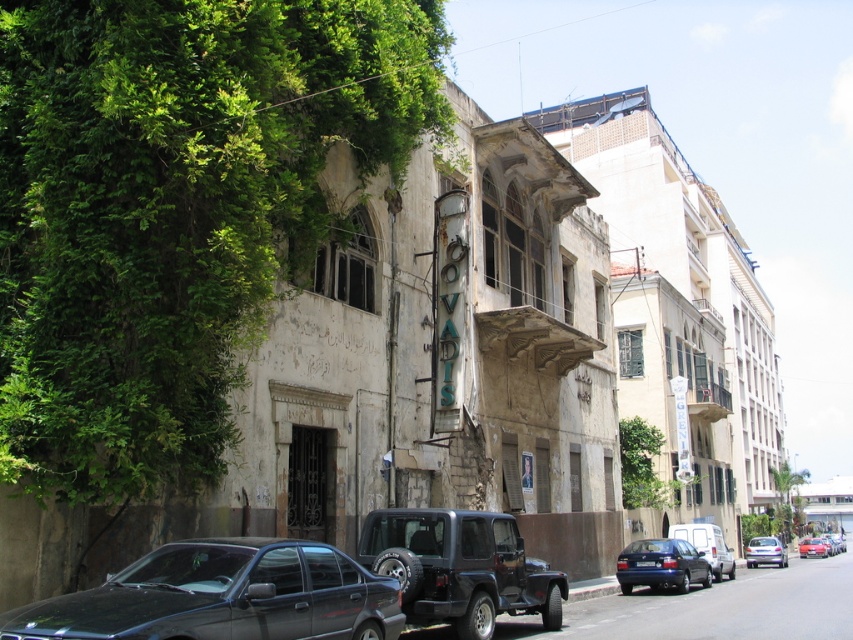
Does green leafy vines at left have a larger size compared to matte blue sedan at lower right?

Yes, green leafy vines at left is bigger than matte blue sedan at lower right.

Between point (273, 262) and point (646, 547), which one is positioned in front?

Point (273, 262) is in front.

This screenshot has width=853, height=640. I want to click on green leafy vines at left, so click(x=173, y=209).

Between purple glossy hatchback at lower right and blue matte license plate at center, which one has less height?

blue matte license plate at center is shorter.

What do you see at coordinates (764, 552) in the screenshot? I see `purple glossy hatchback at lower right` at bounding box center [764, 552].

Is point (759, 563) positioned behind point (637, 563)?

Yes, point (759, 563) is behind point (637, 563).

At what (x,y) coordinates should I click in order to perform the action: click on purple glossy hatchback at lower right. Please return your answer as a coordinate pair (x, y). This screenshot has width=853, height=640. Looking at the image, I should click on (764, 552).

Between point (677, 572) and point (636, 564), which one is positioned in front?

Point (677, 572) is more forward.

Between matte blue sedan at lower right and blue matte license plate at center, which one has more height?

matte blue sedan at lower right

This screenshot has width=853, height=640. I want to click on matte blue sedan at lower right, so click(662, 564).